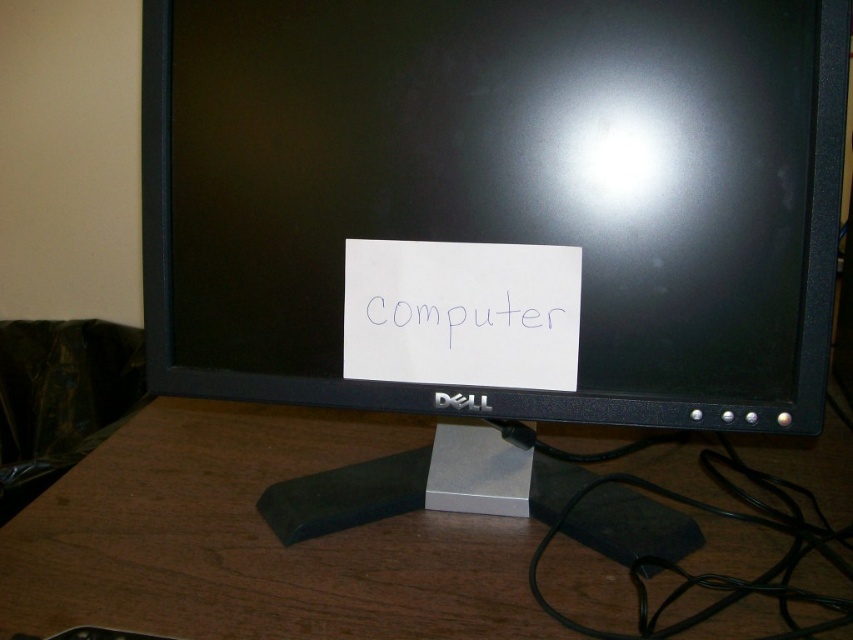
Can you confirm if black plastic monitor at center is positioned to the right of white paper at center?

Correct, you'll find black plastic monitor at center to the right of white paper at center.

Can you confirm if black plastic monitor at center is taller than white paper at center?

Yes.

Locate an element on the screen. black plastic monitor at center is located at coordinates (497, 202).

Which of these two, brown wood computer desk at center or white paper at center, stands taller?

brown wood computer desk at center

Can you confirm if brown wood computer desk at center is positioned below white paper at center?

Yes, brown wood computer desk at center is below white paper at center.

Between point (403, 440) and point (531, 301), which one is positioned behind?

The point (403, 440) is behind.

Where is `brown wood computer desk at center`? brown wood computer desk at center is located at coordinates (254, 540).

Is point (206, 244) farther from camera compared to point (268, 611)?

That is True.

Describe the element at coordinates (497, 202) in the screenshot. I see `black plastic monitor at center` at that location.

Does point (517, 500) lie behind point (376, 621)?

Yes, point (517, 500) is farther from viewer.

You are a GUI agent. You are given a task and a screenshot of the screen. Output one action in this format:
    pyautogui.click(x=<x>, y=<y>)
    Task: Click on the black plastic monitor at center
    The image size is (853, 640).
    Given the screenshot: What is the action you would take?
    (497, 202)